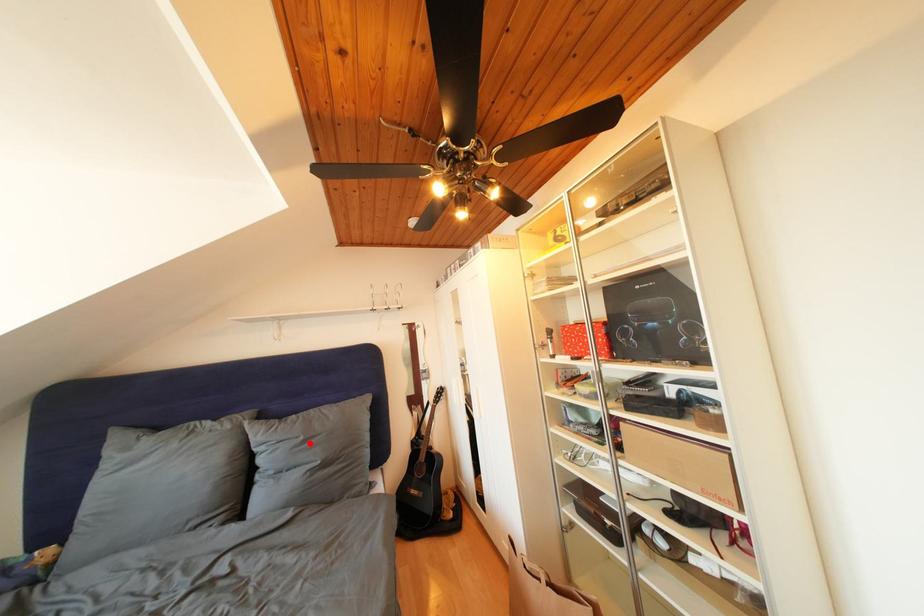
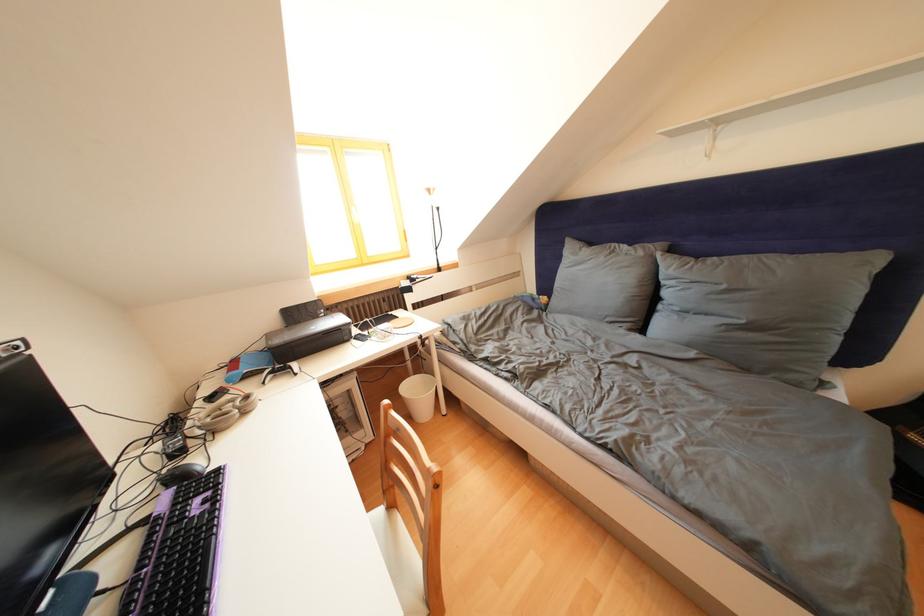
Locate, in the second image, the point that corresponds to the highlighted location in the first image.

(733, 292)